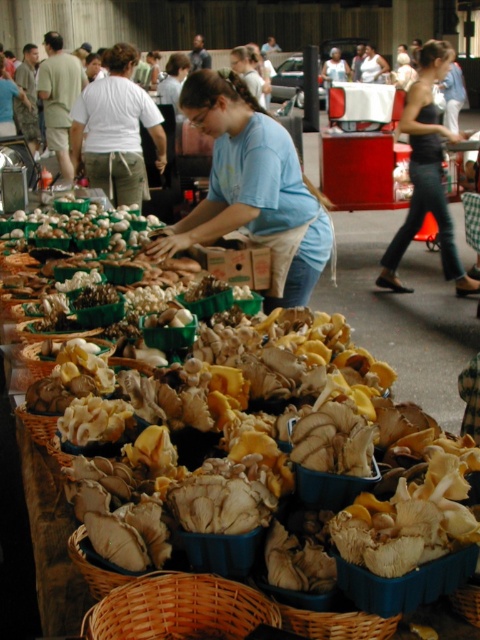
Question: Among these objects, which one is nearest to the camera?

Choices:
 (A) matte blue shirt at center
 (B) blue cotton shirt at center
 (C) woven brown basket at lower center

Answer: (C)

Question: Which point is farther to the camera?

Choices:
 (A) blue cotton shirt at center
 (B) matte blue shirt at center

Answer: (B)

Question: Does blue cotton shirt at center have a lesser width compared to black denim jeans at lower right?

Choices:
 (A) no
 (B) yes

Answer: (B)

Question: Can you confirm if woven brown basket at lower center is positioned above matte blue shirt at center?

Choices:
 (A) no
 (B) yes

Answer: (A)

Question: Considering the real-world distances, which object is closest to the black denim jeans at lower right?

Choices:
 (A) matte blue shirt at center
 (B) blue cotton shirt at center

Answer: (B)

Question: Is woven brown basket at lower center in front of matte blue shirt at center?

Choices:
 (A) yes
 (B) no

Answer: (A)